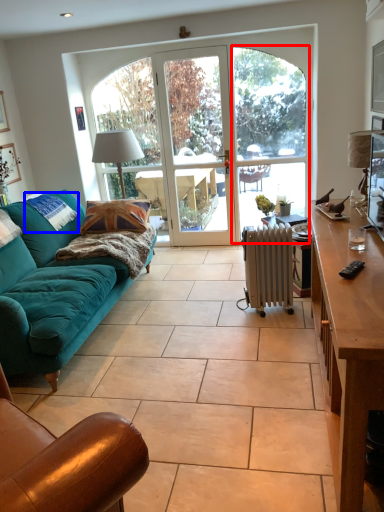
Question: Among these objects, which one is farthest to the camera, glass door (highlighted by a red box) or pillow (highlighted by a blue box)?

Choices:
 (A) glass door
 (B) pillow

Answer: (A)